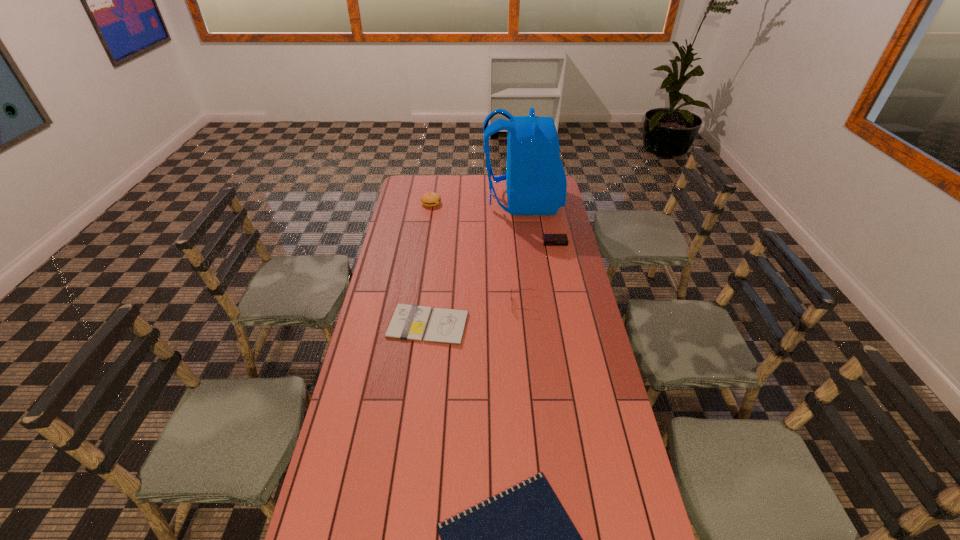
Where is `alarm clock that is at the right edge`? alarm clock that is at the right edge is located at coordinates (548, 239).

Find the location of a particular element. The width and height of the screenshot is (960, 540). object present at the far right corner is located at coordinates (536, 183).

Locate an element on the screen. The height and width of the screenshot is (540, 960). vacant space at the far edge of the desktop is located at coordinates (472, 181).

Identify the location of free space at the left edge. Image resolution: width=960 pixels, height=540 pixels. (335, 453).

The height and width of the screenshot is (540, 960). I want to click on free space at the right edge of the desktop, so click(x=569, y=390).

In the image, there is a desktop. What are the coordinates of `vacant space at the far left corner` in the screenshot? It's located at (422, 180).

Image resolution: width=960 pixels, height=540 pixels. Identify the location of vacant space in between the second tallest object and the third tallest object. (477, 254).

I want to click on free space between the taller notepad and the fourth shortest object, so click(x=476, y=314).

Find the location of a particular element. vacant space that is in between the backpack and the third farthest object is located at coordinates (539, 222).

Locate an element on the screen. The height and width of the screenshot is (540, 960). free space between the alarm clock and the backpack is located at coordinates (539, 222).